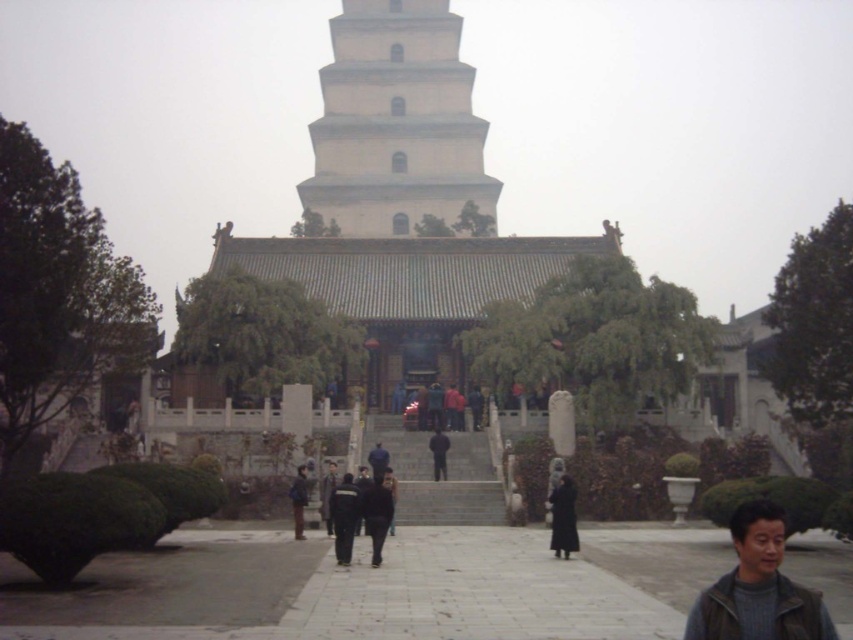
Does black matte coat at center have a lesser height compared to black matte jacket at center?

No, black matte coat at center is not shorter than black matte jacket at center.

Can you confirm if black matte coat at center is positioned to the left of black matte jacket at center?

In fact, black matte coat at center is to the right of black matte jacket at center.

Is point (556, 545) farther from viewer compared to point (442, 476)?

No, it is not.

You are a GUI agent. You are given a task and a screenshot of the screen. Output one action in this format:
    pyautogui.click(x=<x>, y=<y>)
    Task: Click on the black matte coat at center
    This screenshot has height=640, width=853.
    Given the screenshot: What is the action you would take?
    pyautogui.click(x=563, y=518)

Is the position of dark gray jacket at lower right more distant than that of black matte coat at center?

No, dark gray jacket at lower right is closer to the viewer.

Which is behind, point (761, 540) or point (560, 499)?

Positioned behind is point (560, 499).

The height and width of the screenshot is (640, 853). In order to click on dark gray jacket at lower right in this screenshot , I will do `click(758, 588)`.

Does black matte coat at center lie behind black fabric coat at center?

No.

Does black matte coat at center have a larger size compared to black fabric coat at center?

Correct, black matte coat at center is larger in size than black fabric coat at center.

Image resolution: width=853 pixels, height=640 pixels. What do you see at coordinates (563, 518) in the screenshot?
I see `black matte coat at center` at bounding box center [563, 518].

In order to click on black matte coat at center in this screenshot , I will do `click(563, 518)`.